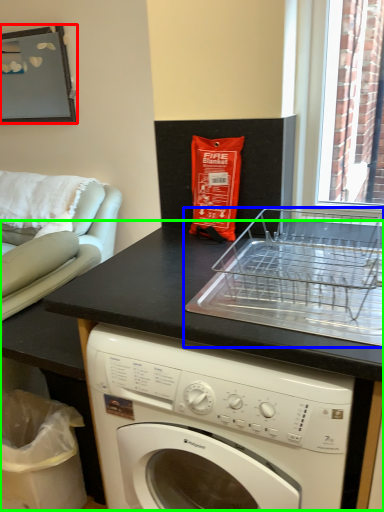
Question: Which is farther away from picture frame (highlighted by a red box)? appliance (highlighted by a blue box) or counter (highlighted by a green box)?

Choices:
 (A) appliance
 (B) counter

Answer: (A)